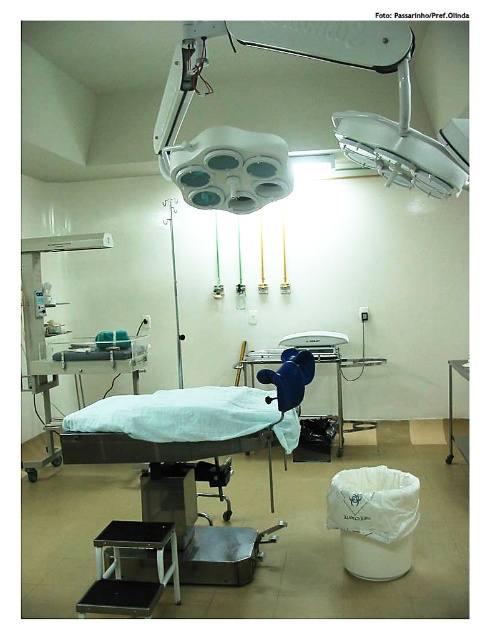
Question: Does white matte bed at center have a greater width compared to blue plastic chair at center?

Choices:
 (A) yes
 (B) no

Answer: (B)

Question: Does black plastic stool at lower left lie in front of blue plastic chair at center?

Choices:
 (A) no
 (B) yes

Answer: (B)

Question: Is black plastic stool at lower left closer to the viewer compared to blue plastic chair at center?

Choices:
 (A) yes
 (B) no

Answer: (A)

Question: Which of the following is the farthest from the observer?

Choices:
 (A) black plastic stool at lower left
 (B) white plastic trash can at lower right

Answer: (B)

Question: Considering the real-world distances, which object is farthest from the black plastic stool at lower left?

Choices:
 (A) white matte bed at center
 (B) white matte surgical light at upper center
 (C) blue plastic chair at center
 (D) white plastic trash can at lower right

Answer: (D)

Question: Which of these objects is positioned closest to the white matte bed at center?

Choices:
 (A) white plastic trash can at lower right
 (B) blue plastic chair at center
 (C) black plastic stool at lower left
 (D) white matte surgical light at upper center

Answer: (C)